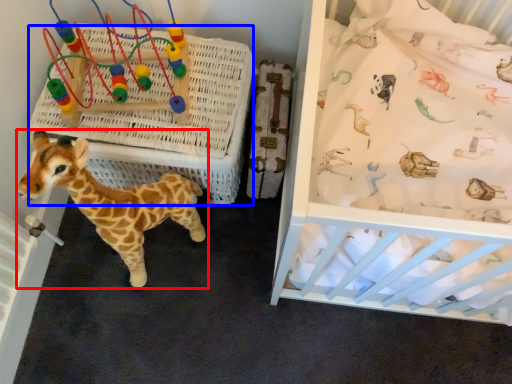
Question: Which object is further to the camera taking this photo, giraffe (highlighted by a red box) or crate (highlighted by a blue box)?

Choices:
 (A) giraffe
 (B) crate

Answer: (B)